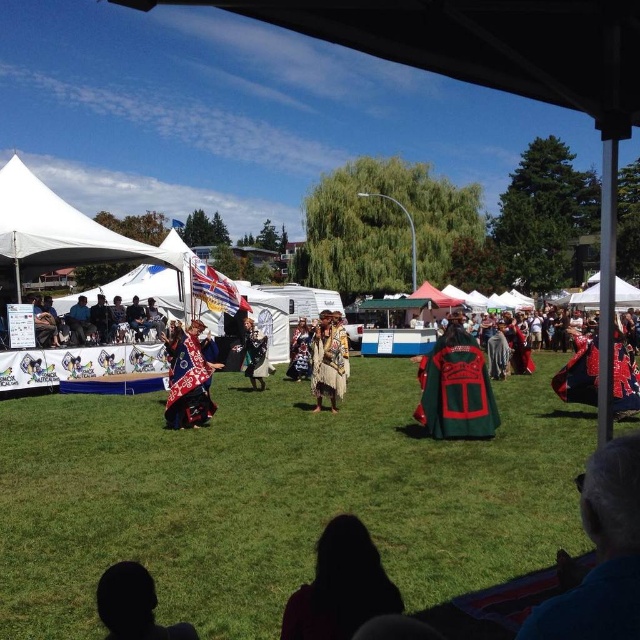
You are planning to set up a small table in the center of the grassy field where the green grass at center and green velvet cape at center are located. Considering their widths, which object would allow the table to be placed without overlapping either of them?

The green grass at center has a larger width than the green velvet cape at center, so placing the table in the center between them would be possible as long as the table is smaller than the grass area.

In the scene shown: You are an attendee at the event and want to take a photo of both the silhouette fabric at lower center and the embroidered velvet cape at center. Which object should you frame first in your camera to ensure both are in the shot?

The silhouette fabric at lower center should be framed first since it is to the left of the embroidered velvet cape at center, so positioning the camera to include both requires starting from the left side where the silhouette fabric at lower center is located.